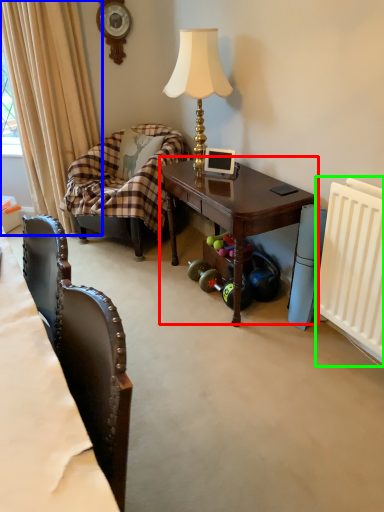
Question: Based on their relative distances, which object is nearer to table (highlighted by a red box)? Choose from curtain (highlighted by a blue box) and radiator (highlighted by a green box).

Choices:
 (A) curtain
 (B) radiator

Answer: (B)